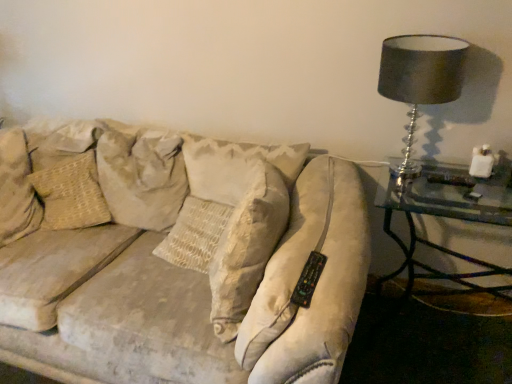
What do you see at coordinates (71, 193) in the screenshot? I see `beige textured pillow at left, the second pillow when ordered from right to left` at bounding box center [71, 193].

How much space does beige textured pillow at left, the second pillow when ordered from right to left, occupy horizontally?

beige textured pillow at left, the second pillow when ordered from right to left, is 10.28 inches wide.

What do you see at coordinates (449, 218) in the screenshot? I see `clear glass table at right` at bounding box center [449, 218].

The image size is (512, 384). I want to click on beige textured pillow at left, the second pillow when ordered from right to left, so click(x=71, y=193).

Does matte black lampshade at upper right have a smaller size compared to beige textured pillow at left, the second pillow when ordered from right to left?

Indeed, matte black lampshade at upper right has a smaller size compared to beige textured pillow at left, the second pillow when ordered from right to left.

From a real-world perspective, is matte black lampshade at upper right above or below beige textured pillow at left, which ranks as the 1th pillow in left-to-right order?

In terms of real-world spatial position, matte black lampshade at upper right is above beige textured pillow at left, which ranks as the 1th pillow in left-to-right order.

From the image's perspective, does matte black lampshade at upper right appear higher than beige textured pillow at left, the second pillow when ordered from right to left?

Yes, from the image's perspective, matte black lampshade at upper right is on top of beige textured pillow at left, the second pillow when ordered from right to left.

Which object is closer to the camera taking this photo, matte black lampshade at upper right or beige textured pillow at left, the second pillow when ordered from right to left?

matte black lampshade at upper right is closer to the camera.

Which is nearer, (x=104, y=143) or (x=41, y=226)?

The point (x=104, y=143) is more forward.

Is beige fabric pillow at upper left, the second pillow from the left, thinner than beige textured pillow at left, which ranks as the 1th pillow in left-to-right order?

Incorrect, the width of beige fabric pillow at upper left, the second pillow from the left, is not less than that of beige textured pillow at left, which ranks as the 1th pillow in left-to-right order.

Is beige fabric pillow at upper left, the second pillow from the left, oriented towards beige textured pillow at left, which ranks as the 1th pillow in left-to-right order?

No, beige fabric pillow at upper left, the second pillow from the left, is not aimed at beige textured pillow at left, which ranks as the 1th pillow in left-to-right order.

Considering the relative sizes of beige fabric pillow at upper left, the second pillow from the left, and beige textured pillow at left, which ranks as the 1th pillow in left-to-right order, in the image provided, is beige fabric pillow at upper left, the second pillow from the left, taller than beige textured pillow at left, which ranks as the 1th pillow in left-to-right order,?

Yes, beige fabric pillow at upper left, the second pillow from the left, is taller than beige textured pillow at left, which ranks as the 1th pillow in left-to-right order.

Is beige textured pillow at left, the second pillow when ordered from right to left, far from matte black lampshade at upper right?

Absolutely, beige textured pillow at left, the second pillow when ordered from right to left, is distant from matte black lampshade at upper right.

Between beige textured pillow at left, the second pillow when ordered from right to left, and matte black lampshade at upper right, which one has smaller width?

matte black lampshade at upper right.

Considering the positions of objects beige textured pillow at left, the second pillow when ordered from right to left, and matte black lampshade at upper right in the image provided, who is more to the left, beige textured pillow at left, the second pillow when ordered from right to left, or matte black lampshade at upper right?

beige textured pillow at left, the second pillow when ordered from right to left.

Is beige textured pillow at left, the second pillow when ordered from right to left, spatially inside clear glass table at right, or outside of it?

beige textured pillow at left, the second pillow when ordered from right to left, lies outside clear glass table at right.

Between beige textured pillow at left, the second pillow when ordered from right to left, and clear glass table at right, which one appears on the left side from the viewer's perspective?

beige textured pillow at left, the second pillow when ordered from right to left.

Between beige textured pillow at left, the second pillow when ordered from right to left, and clear glass table at right, which one has smaller size?

Smaller between the two is beige textured pillow at left, the second pillow when ordered from right to left.

From the image's perspective, relative to clear glass table at right, is beige textured pillow at left, the second pillow when ordered from right to left, above or below?

From the image's perspective, beige textured pillow at left, the second pillow when ordered from right to left, appears above clear glass table at right.

Consider the image. How many degrees apart are the facing directions of clear glass table at right and matte black lampshade at upper right?

The angular difference between clear glass table at right and matte black lampshade at upper right is 1.8 degrees.

Is clear glass table at right inside the boundaries of matte black lampshade at upper right, or outside?

clear glass table at right is not enclosed by matte black lampshade at upper right.

From a real-world perspective, is clear glass table at right physically below matte black lampshade at upper right?

Yes, from a real-world perspective, clear glass table at right is beneath matte black lampshade at upper right.

Identify the location of table in front of the matte black lampshade at upper right. click(x=449, y=218).

Does point (170, 162) come closer to viewer compared to point (480, 290)?

Yes, it is in front of point (480, 290).

In the scene shown: Is beige fabric pillow at upper left, which is counted as the 1th pillow, starting from the right, positioned in front of clear glass table at right?

No, beige fabric pillow at upper left, which is counted as the 1th pillow, starting from the right, is behind clear glass table at right.

Where is `table that appears on the right of beige fabric pillow at upper left, the second pillow from the left`? The height and width of the screenshot is (384, 512). table that appears on the right of beige fabric pillow at upper left, the second pillow from the left is located at coordinates (449, 218).

Considering the relative sizes of beige textured pillow at left, which ranks as the 1th pillow in left-to-right order, and beige fabric pillow at upper left, which is counted as the 1th pillow, starting from the right, in the image provided, is beige textured pillow at left, which ranks as the 1th pillow in left-to-right order, thinner than beige fabric pillow at upper left, which is counted as the 1th pillow, starting from the right,?

Indeed, beige textured pillow at left, which ranks as the 1th pillow in left-to-right order, has a lesser width compared to beige fabric pillow at upper left, which is counted as the 1th pillow, starting from the right.

Is beige textured pillow at left, the second pillow when ordered from right to left, oriented towards beige fabric pillow at upper left, which is counted as the 1th pillow, starting from the right?

No, beige textured pillow at left, the second pillow when ordered from right to left, is not turned towards beige fabric pillow at upper left, which is counted as the 1th pillow, starting from the right.

Is beige fabric pillow at upper left, the second pillow from the left, located within beige textured pillow at left, the second pillow when ordered from right to left?

No, beige fabric pillow at upper left, the second pillow from the left, is not surrounded by beige textured pillow at left, the second pillow when ordered from right to left.

Who is smaller, beige textured pillow at left, which ranks as the 1th pillow in left-to-right order, or beige fabric pillow at upper left, which is counted as the 1th pillow, starting from the right?

With smaller size is beige textured pillow at left, which ranks as the 1th pillow in left-to-right order.

This screenshot has width=512, height=384. I want to click on table lamp that appears in front of the beige textured pillow at left, which ranks as the 1th pillow in left-to-right order, so click(420, 80).

You are a GUI agent. You are given a task and a screenshot of the screen. Output one action in this format:
    pyautogui.click(x=<x>, y=<y>)
    Task: Click on the pillow on the left of beige fabric pillow at upper left, the second pillow from the left
    This screenshot has width=512, height=384.
    Given the screenshot: What is the action you would take?
    pyautogui.click(x=71, y=193)

Which object lies nearer to the anchor point beige textured pillow at left, the second pillow when ordered from right to left, clear glass table at right or matte black lampshade at upper right?

matte black lampshade at upper right.

Considering their positions, is beige fabric pillow at upper left, the second pillow from the left, positioned closer to clear glass table at right than beige textured pillow at left, which ranks as the 1th pillow in left-to-right order?

Based on the image, beige fabric pillow at upper left, the second pillow from the left, appears to be nearer to clear glass table at right.

When comparing their distances from clear glass table at right, does matte black lampshade at upper right or beige textured pillow at left, which ranks as the 1th pillow in left-to-right order, seem further?

Based on the image, beige textured pillow at left, which ranks as the 1th pillow in left-to-right order, appears to be further to clear glass table at right.

From the image, which object appears to be farther from matte black lampshade at upper right, beige textured pillow at left, the second pillow when ordered from right to left, or clear glass table at right?

beige textured pillow at left, the second pillow when ordered from right to left, is further to matte black lampshade at upper right.

From the image, which object appears to be farther from matte black lampshade at upper right, clear glass table at right or beige textured pillow at left, which ranks as the 1th pillow in left-to-right order?

The object further to matte black lampshade at upper right is beige textured pillow at left, which ranks as the 1th pillow in left-to-right order.

When comparing their distances from clear glass table at right, does matte black lampshade at upper right or beige fabric pillow at upper left, the second pillow from the left, seem closer?

matte black lampshade at upper right.

Based on their spatial positions, is beige textured pillow at left, which ranks as the 1th pillow in left-to-right order, or beige fabric pillow at upper left, the second pillow from the left, closer to clear glass table at right?

beige fabric pillow at upper left, the second pillow from the left, lies closer to clear glass table at right than the other object.

Considering their positions, is beige fabric pillow at upper left, the second pillow from the left, positioned further to beige textured pillow at left, which ranks as the 1th pillow in left-to-right order, than matte black lampshade at upper right?

matte black lampshade at upper right is further to beige textured pillow at left, which ranks as the 1th pillow in left-to-right order.

The height and width of the screenshot is (384, 512). What are the coordinates of `pillow located between beige textured pillow at left, the second pillow when ordered from right to left, and clear glass table at right in the left-right direction` in the screenshot? It's located at (142, 177).

You are a GUI agent. You are given a task and a screenshot of the screen. Output one action in this format:
    pyautogui.click(x=<x>, y=<y>)
    Task: Click on the pillow between beige textured pillow at left, which ranks as the 1th pillow in left-to-right order, and matte black lampshade at upper right from left to right
    
    Given the screenshot: What is the action you would take?
    pyautogui.click(x=142, y=177)

The height and width of the screenshot is (384, 512). Find the location of `table lamp located between beige fabric pillow at upper left, which is counted as the 1th pillow, starting from the right, and clear glass table at right in the left-right direction`. table lamp located between beige fabric pillow at upper left, which is counted as the 1th pillow, starting from the right, and clear glass table at right in the left-right direction is located at coordinates (420, 80).

This screenshot has width=512, height=384. Find the location of `table lamp situated between beige textured pillow at left, which ranks as the 1th pillow in left-to-right order, and clear glass table at right from left to right`. table lamp situated between beige textured pillow at left, which ranks as the 1th pillow in left-to-right order, and clear glass table at right from left to right is located at coordinates (420, 80).